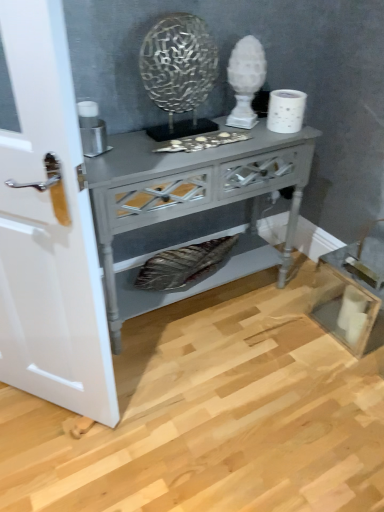
At what (x,y) coordinates should I click in order to perform the action: click on vacant region to the right of white glossy door at left. Please return your answer as a coordinate pair (x, y). The image size is (384, 512). Looking at the image, I should click on (147, 416).